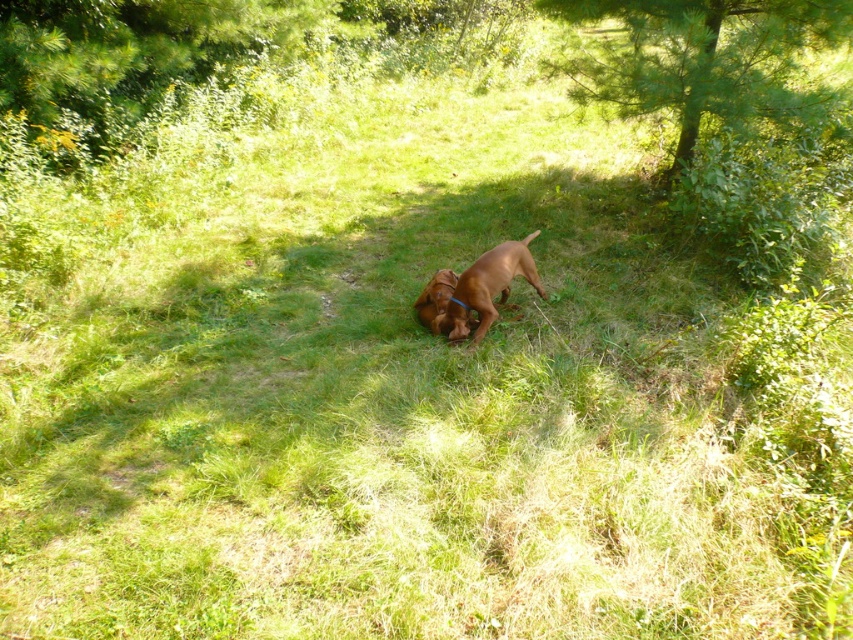
You are a photographer aiming to capture the brown glossy dog at center and the green leafy tree at upper right in the same frame. Based on their sizes, which one would appear wider in the photo?

The green leafy tree at upper right appears wider in the photo because its width surpasses that of the brown glossy dog at center according to the description.

You are a dog owner who wants to choose the right size of the dog bed for your pet. You see two dogs in the image, a brown glossy dog at center and a brown furry dog at center. Which dog requires a larger bed?

The brown glossy dog at center requires a larger bed since it has a larger size compared to the brown furry dog at center.

In the scene shown: You are standing at the center of the grassy area and want to take a photo of the green leafy tree at upper right. Which direction should you face to ensure the tree is in the frame?

The green leafy tree at upper right is located at point coordinates, so you should face towards the upper right direction to ensure the tree is in the frame.